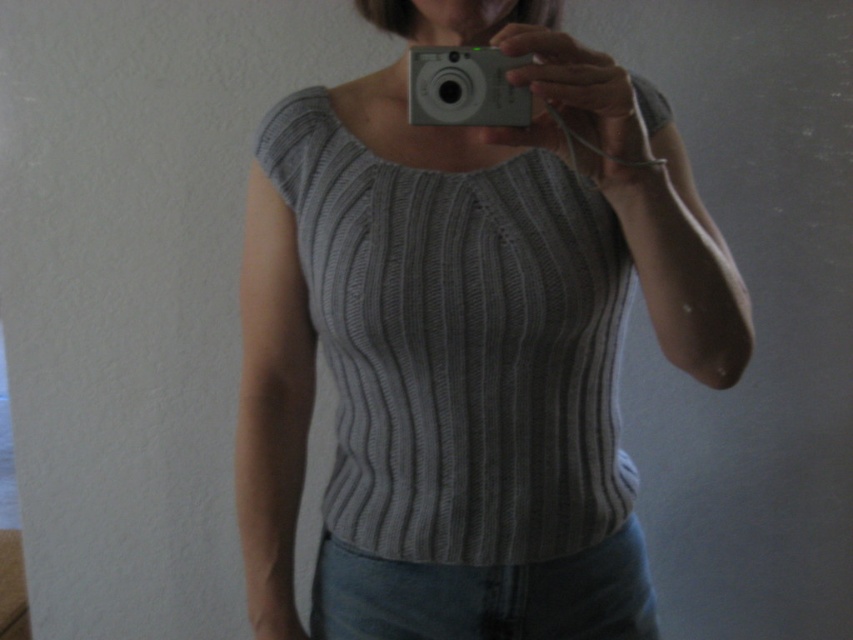
You are a photographer trying to adjust the focus on your camera. The gray ribbed knit top at center and the white plastic camera at upper center are both in the frame. Which object should you focus on first to ensure the top is in focus?

The gray ribbed knit top at center is in front of the white plastic camera at upper center, so you should focus on the gray ribbed knit top at center first to ensure it is in focus.

You are trying to determine the distance between two points in the image. You know that point A is at coordinates point (469, 428) and point B is at coordinates point (416, 113). Based on the scene, which point is closer to you?

Point point (416, 113) is closer to you because it is less further to the viewer than point point (469, 428).

You are trying to take a selfie with your camera and want to ensure you are positioned correctly. Given that the point where you want to focus is at point [578,541], and the camera is at a certain position, how far apart are they in inches?

The point [578,541] and the camera are 35.14 inches apart.